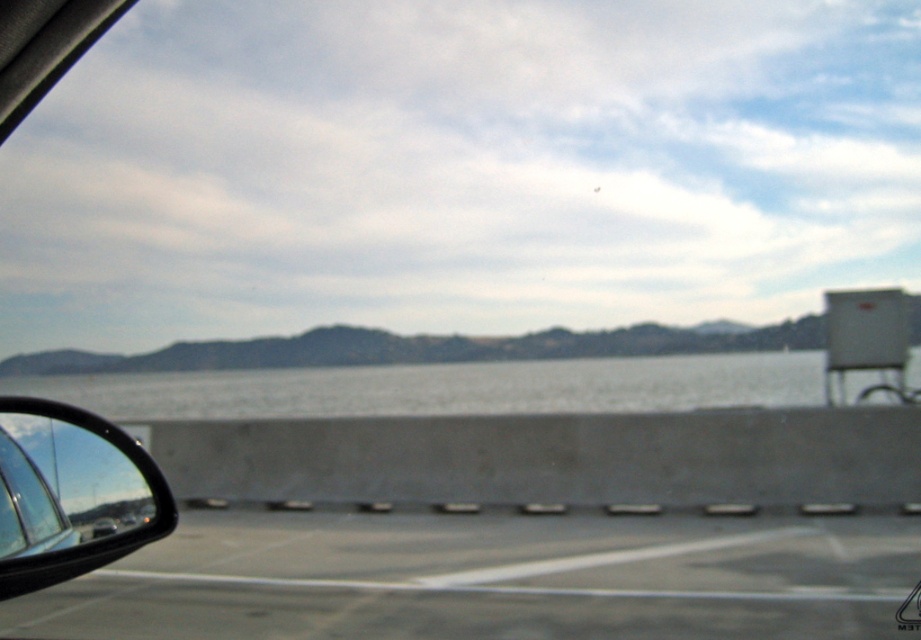
Question: Where is gray asphalt highway at lower left located in relation to gray concrete water at center in the image?

Choices:
 (A) below
 (B) above

Answer: (A)

Question: Does gray concrete water at center appear on the left side of black glossy side mirror at lower left?

Choices:
 (A) no
 (B) yes

Answer: (A)

Question: Based on their relative distances, which object is nearer to the gray concrete water at center?

Choices:
 (A) gray asphalt highway at lower left
 (B) black glossy side mirror at lower left

Answer: (B)

Question: Which object is positioned farthest from the gray concrete water at center?

Choices:
 (A) gray asphalt highway at lower left
 (B) black glossy side mirror at lower left

Answer: (A)

Question: Is gray asphalt highway at lower left smaller than black glossy side mirror at lower left?

Choices:
 (A) yes
 (B) no

Answer: (A)

Question: Which point is farther to the camera?

Choices:
 (A) (353, 412)
 (B) (242, 554)

Answer: (A)